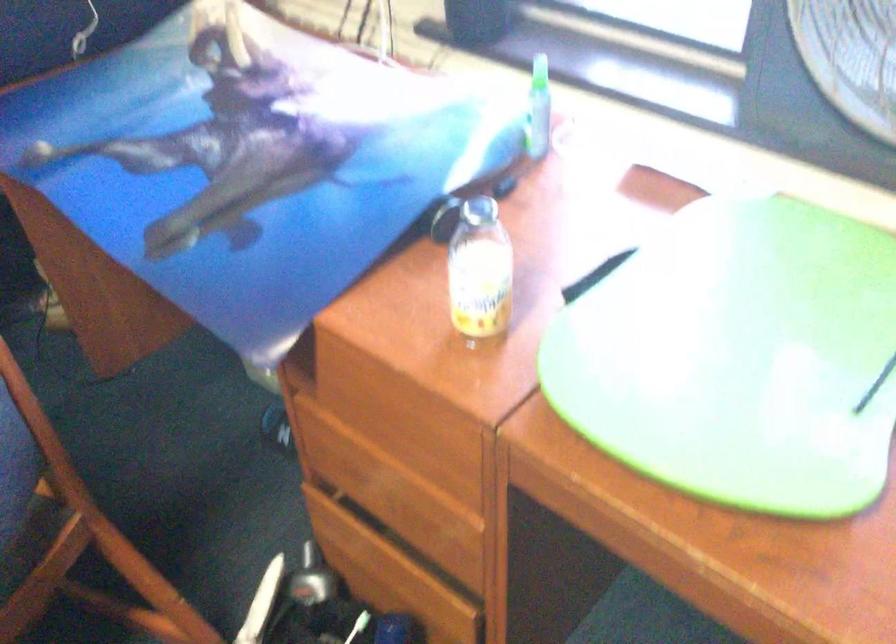
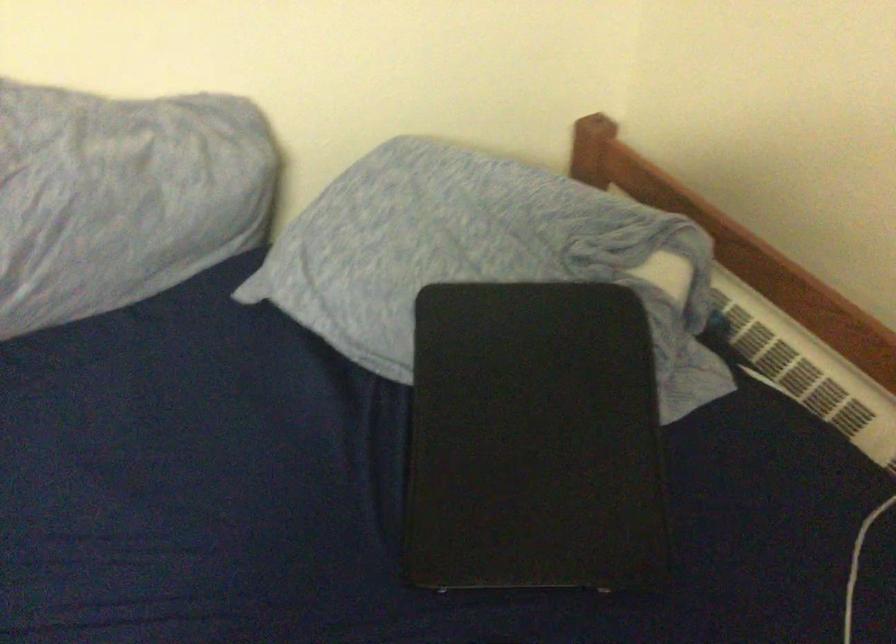
In a continuous first-person perspective shot, in which direction is the camera moving?

The cameraman moved toward left, forward.